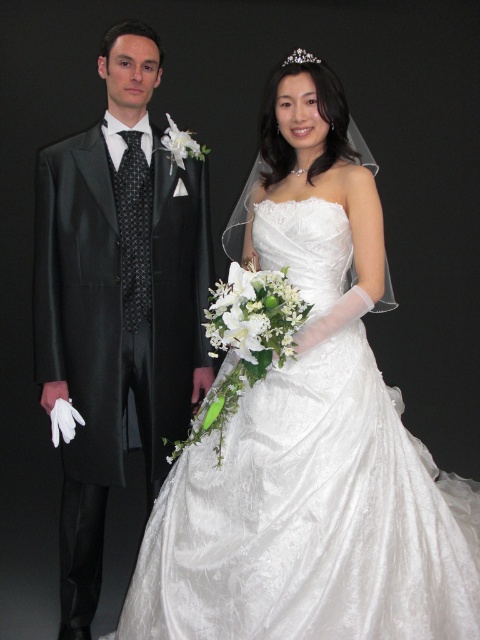
Question: Which is farther from the matte black suit at left?

Choices:
 (A) white satin dress at center
 (B) clear crystal tiara at upper center

Answer: (B)

Question: Can you confirm if matte black suit at left is positioned below clear crystal tiara at upper center?

Choices:
 (A) yes
 (B) no

Answer: (A)

Question: Is matte black suit at left to the left of clear crystal tiara at upper center from the viewer's perspective?

Choices:
 (A) no
 (B) yes

Answer: (B)

Question: Based on their relative distances, which object is nearer to the matte black suit at left?

Choices:
 (A) white satin dress at center
 (B) clear crystal tiara at upper center

Answer: (A)

Question: Which point is farther from the camera taking this photo?

Choices:
 (A) (307, 61)
 (B) (132, 52)

Answer: (B)

Question: Is matte black suit at left smaller than clear crystal tiara at upper center?

Choices:
 (A) no
 (B) yes

Answer: (A)